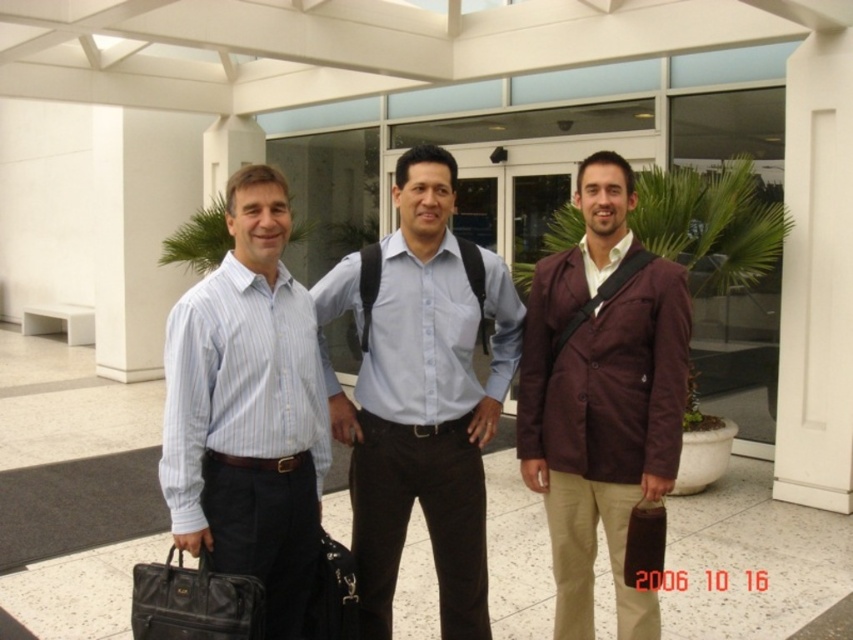
You are a photographer standing 10 feet away from the group of men. You want to take a closeup photo of the light blue shirt at center and the black leather briefcase at lower left. Will the two objects be in focus if your camera has a depth of field that can sharply focus objects within a 30 inch range?

The light blue shirt at center is 31.40 inches away from the black leather briefcase at lower left. Since the distance between them exceeds the camera s 30 inch depth of field range, they cannot both be in focus simultaneously in the closeup photo.

You are a photographer trying to capture a clear shot of the light blue shirt at center and the brown leather briefcase at center. Based on their sizes, which object should you focus on first to ensure it is in sharp focus?

The light blue shirt at center is larger in size than the brown leather briefcase at center, so you should focus on the light blue shirt at center first to ensure it is in sharp focus.

You are a photographer setting up a shot of the three men. You need to ensure the maroon textured blazer at center and the black leather briefcase at lower left are both in frame. Based on their positions, which object is closer to the left edge of the image?

The black leather briefcase at lower left is closer to the left edge of the image because the maroon textured blazer at center is positioned to its right side.